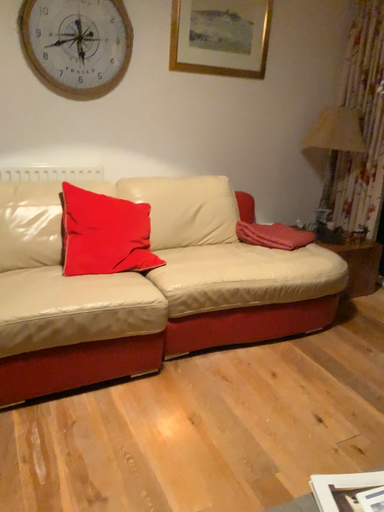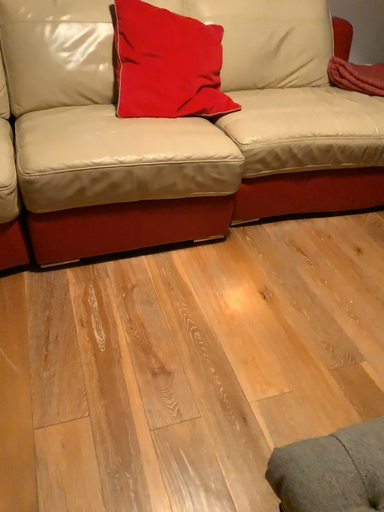
Question: How did the camera likely rotate when shooting the video?

Choices:
 (A) rotated downward
 (B) rotated upward

Answer: (A)